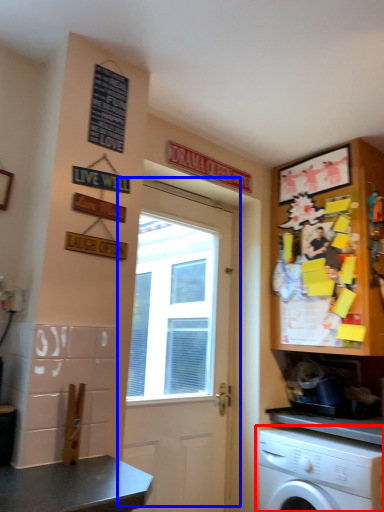
Question: Which object is closer to the camera taking this photo, washing machine (highlighted by a red box) or door (highlighted by a blue box)?

Choices:
 (A) washing machine
 (B) door

Answer: (A)